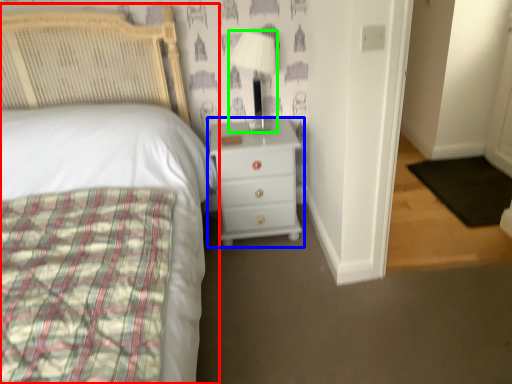
Question: Which object is the closest to the bed (highlighted by a red box)? Choose among these: chest of drawers (highlighted by a blue box) or lamp (highlighted by a green box).

Choices:
 (A) chest of drawers
 (B) lamp

Answer: (A)